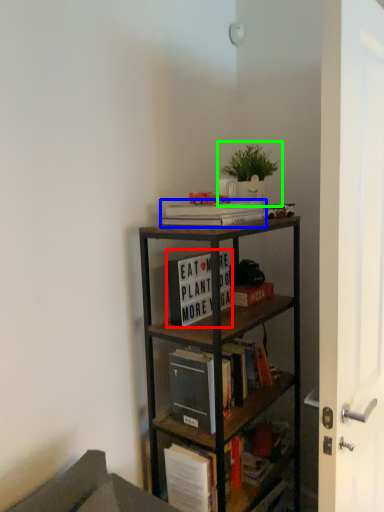
Question: Based on their relative distances, which object is farther from book (highlighted by a red box)? Choose from book (highlighted by a blue box) and houseplant (highlighted by a green box).

Choices:
 (A) book
 (B) houseplant

Answer: (B)